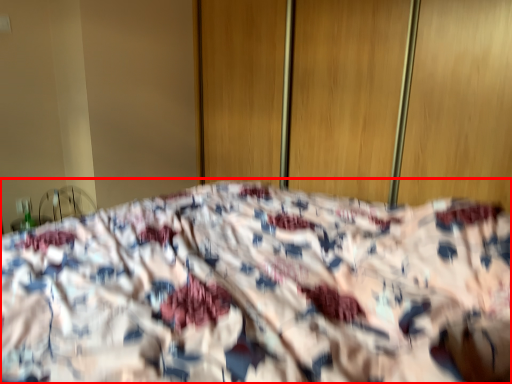
Question: From the image's perspective, what is the correct spatial positioning of bed (annotated by the red box) in reference to screen door?

Choices:
 (A) above
 (B) below

Answer: (B)